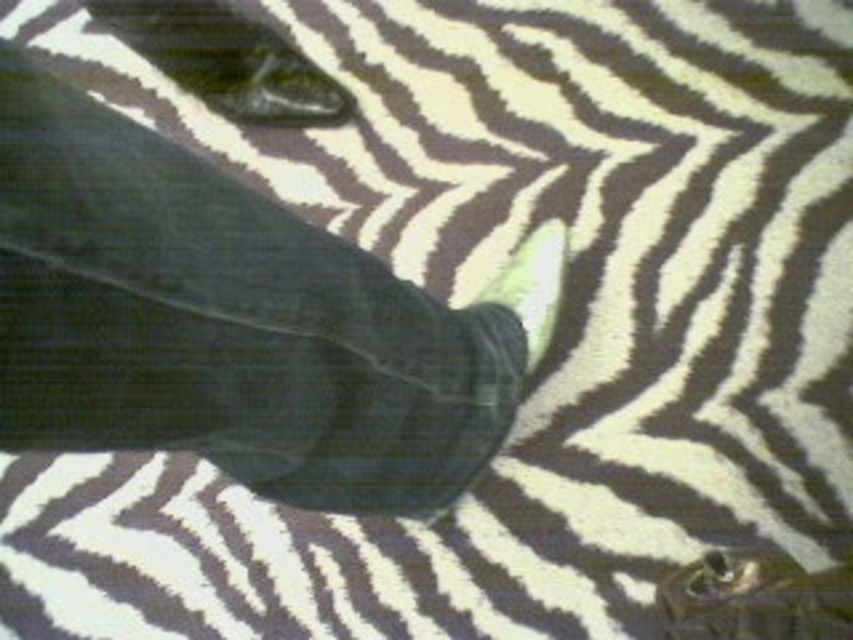
Question: Is matte black shoe at upper left above white soft foot at center?

Choices:
 (A) yes
 (B) no

Answer: (A)

Question: Which object appears closest to the camera in this image?

Choices:
 (A) white soft foot at center
 (B) dark gray fabric at center

Answer: (B)

Question: Which object appears closest to the camera in this image?

Choices:
 (A) white soft foot at center
 (B) matte black shoe at upper left
 (C) dark gray fabric at center

Answer: (C)

Question: Which object appears farthest from the camera in this image?

Choices:
 (A) matte black shoe at upper left
 (B) white soft foot at center
 (C) dark gray fabric at center

Answer: (A)

Question: Does matte black shoe at upper left appear under white soft foot at center?

Choices:
 (A) no
 (B) yes

Answer: (A)

Question: Is dark gray fabric at center smaller than matte black shoe at upper left?

Choices:
 (A) yes
 (B) no

Answer: (B)